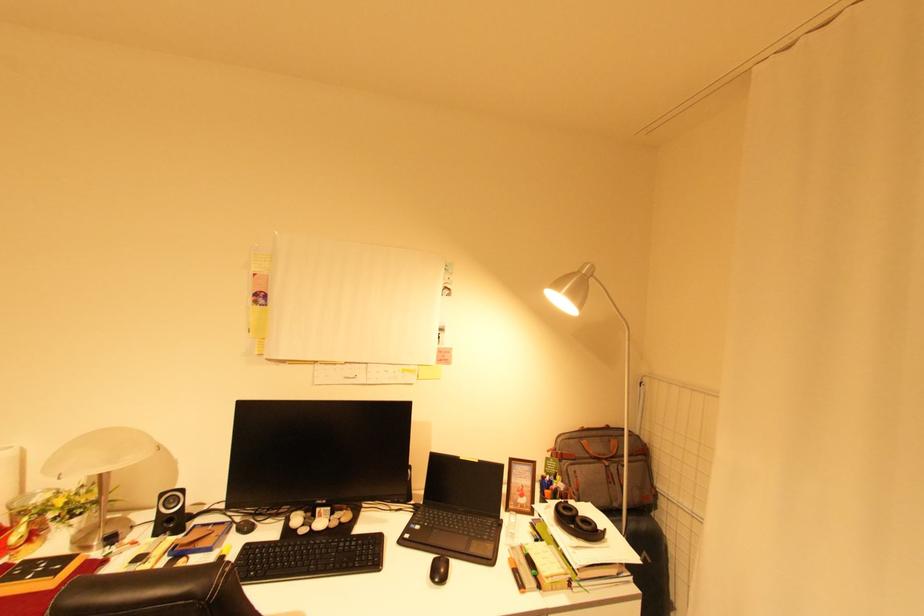
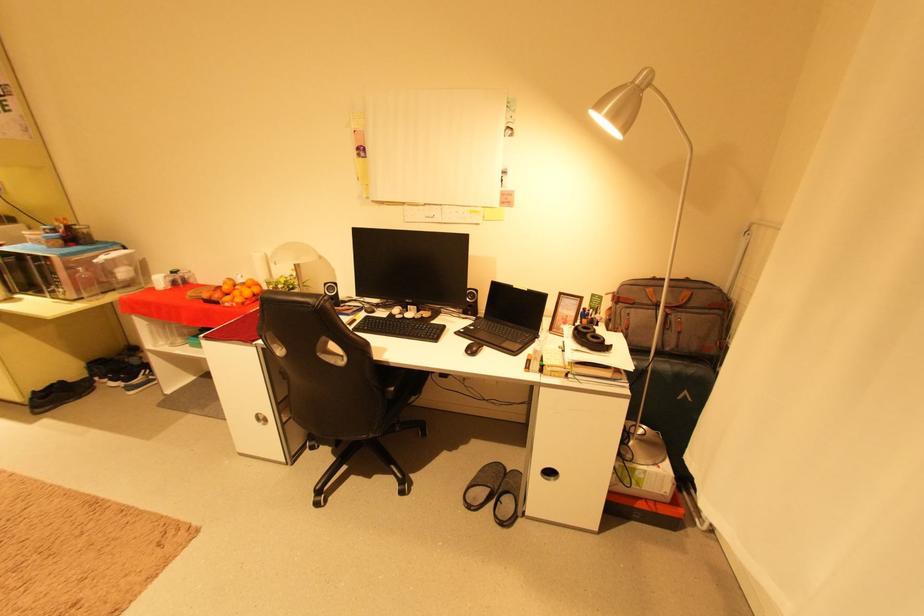
Locate, in the second image, the point that corresponds to (x=585, y=521) in the first image.

(596, 336)